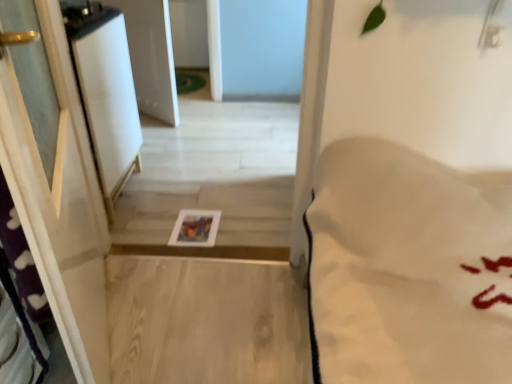
Find the location of a particular element. free area behind white glossy screen door at left is located at coordinates (167, 158).